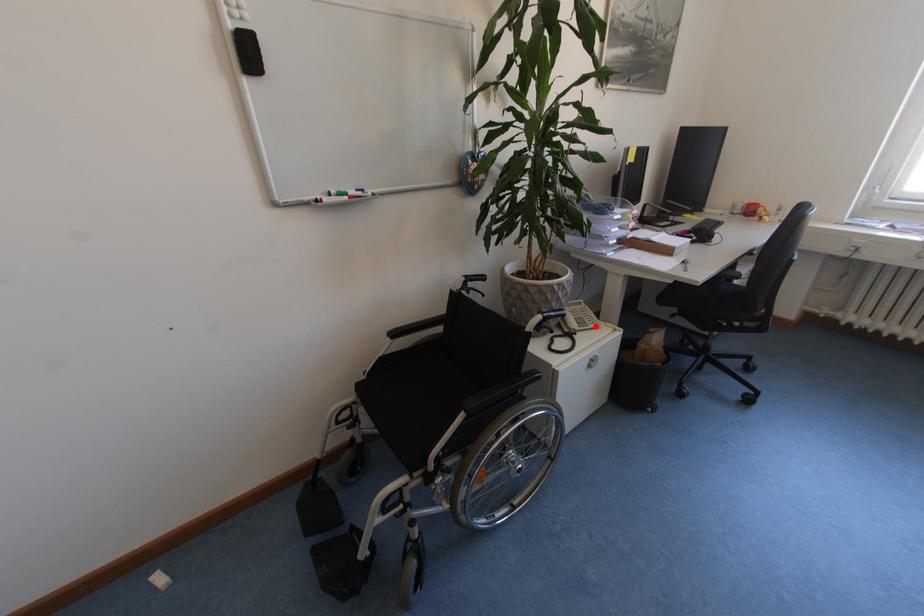
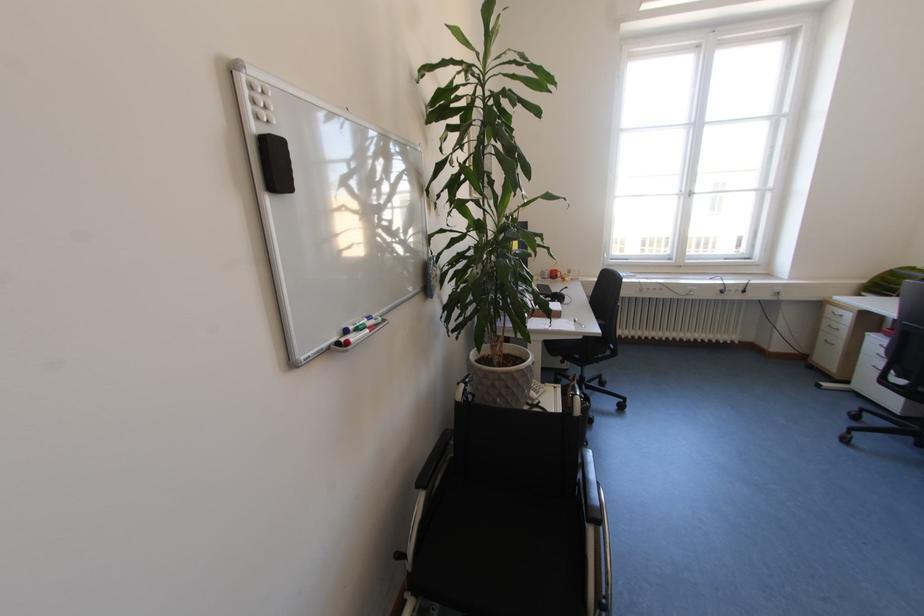
Question: I am providing you with two images of the same scene from different viewpoints. In image1, a red point is highlighted. Considering the same 3D point in image2, which of the following is correct?

Choices:
 (A) It is closer
 (B) It is farther

Answer: (B)